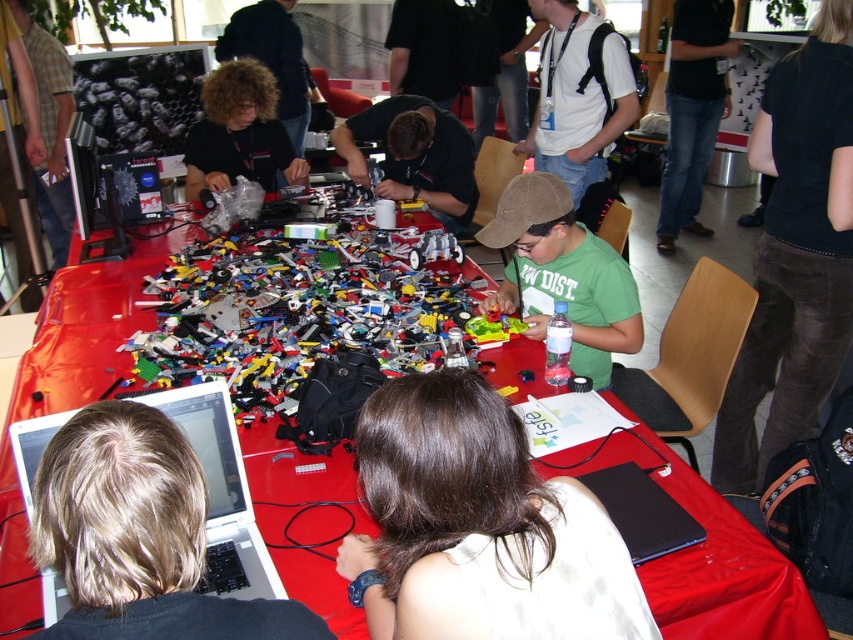
Which is above, green matte shirt at center or black matte shirt at upper center?

black matte shirt at upper center is higher up.

Can you confirm if green matte shirt at center is smaller than black matte shirt at upper center?

Yes, green matte shirt at center is smaller than black matte shirt at upper center.

What do you see at coordinates (561, 275) in the screenshot? The width and height of the screenshot is (853, 640). I see `green matte shirt at center` at bounding box center [561, 275].

Find the location of `green matte shirt at center`. green matte shirt at center is located at coordinates (561, 275).

Which is in front, point (315, 472) or point (32, 467)?

Point (32, 467) is more forward.

Between red plastic table at center and white plastic laptop at lower left, which one is positioned lower?

white plastic laptop at lower left is lower down.

Measure the distance between red plastic table at center and camera.

A distance of 3.46 meters exists between red plastic table at center and camera.

Where is `red plastic table at center`? red plastic table at center is located at coordinates (723, 573).

Does green matte shirt at center have a larger size compared to dark brown shirt at center?

Actually, green matte shirt at center might be smaller than dark brown shirt at center.

Is green matte shirt at center further to camera compared to dark brown shirt at center?

No, it is in front of dark brown shirt at center.

At what (x,y) coordinates should I click in order to perform the action: click on green matte shirt at center. Please return your answer as a coordinate pair (x, y). The width and height of the screenshot is (853, 640). Looking at the image, I should click on (561, 275).

Find the location of a particular element. Image resolution: width=853 pixels, height=640 pixels. green matte shirt at center is located at coordinates (561, 275).